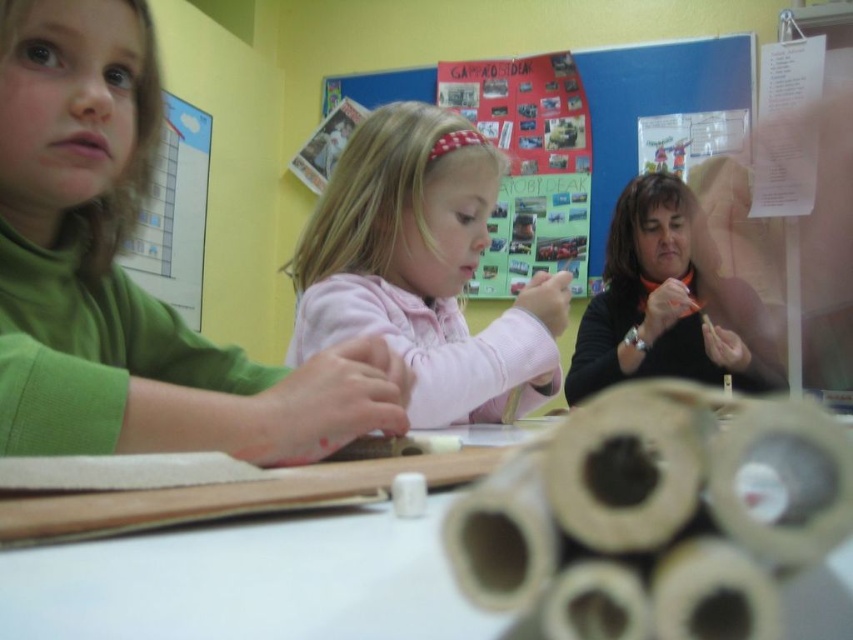
Can you confirm if green matte shirt at left is smaller than white cardboard tubes at lower center?

No, green matte shirt at left is not smaller than white cardboard tubes at lower center.

Looking at this image, does green matte shirt at left appear over white cardboard tubes at lower center?

Indeed, green matte shirt at left is positioned over white cardboard tubes at lower center.

Which is behind, point (22, 96) or point (212, 579)?

Point (22, 96)

Locate an element on the screen. This screenshot has width=853, height=640. green matte shirt at left is located at coordinates (126, 276).

Can you confirm if green matte shirt at left is wider than pink fleece jacket at center?

Incorrect, green matte shirt at left's width does not surpass pink fleece jacket at center's.

Does green matte shirt at left appear on the left side of pink fleece jacket at center?

Correct, you'll find green matte shirt at left to the left of pink fleece jacket at center.

Is point (107, 248) closer to camera compared to point (387, 124)?

Yes, point (107, 248) is closer to viewer.

Find the location of a particular element. The image size is (853, 640). green matte shirt at left is located at coordinates (126, 276).

Does pink fleece jacket at center appear under multicolored paper collage at upper center?

Yes, pink fleece jacket at center is below multicolored paper collage at upper center.

Between point (474, 388) and point (518, 273), which one is positioned in front?

Point (474, 388)

This screenshot has width=853, height=640. I want to click on pink fleece jacket at center, so click(422, 268).